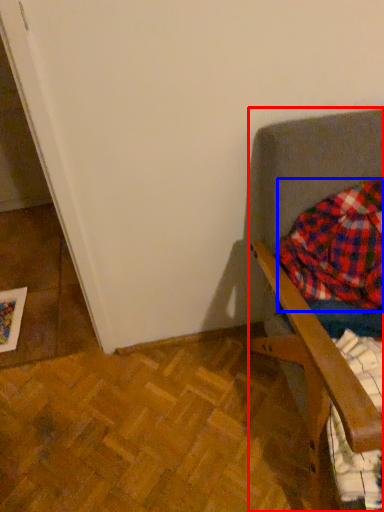
Question: Among these objects, which one is nearest to the camera, furniture (highlighted by a red box) or flannel (highlighted by a blue box)?

Choices:
 (A) furniture
 (B) flannel

Answer: (A)